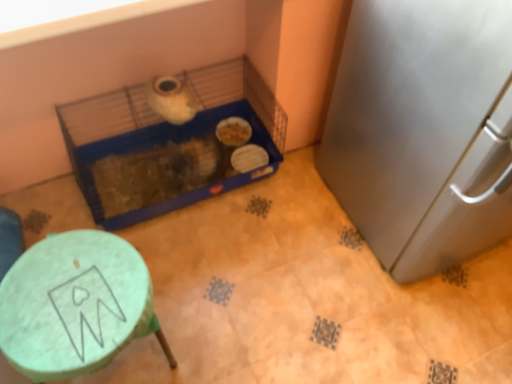
This screenshot has width=512, height=384. In order to click on free space to the right of green matte stool at lower left in this screenshot , I will do `click(219, 328)`.